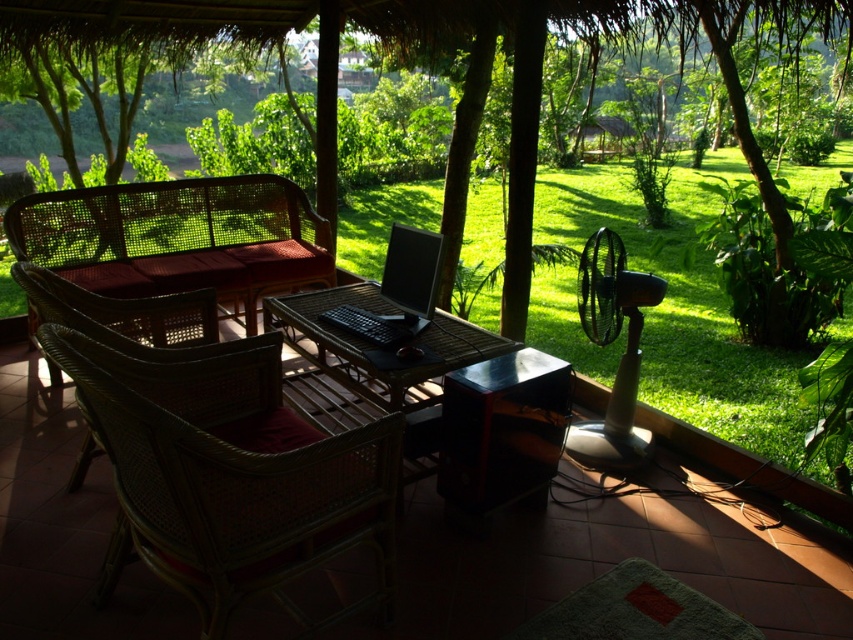
Is point (112, 340) more distant than point (427, 314)?

That is False.

Between woven rattan chair at left and black matte laptop at center, which one is positioned lower?

woven rattan chair at left is below.

Who is more forward, (108,307) or (375,323)?

Point (108,307) is in front.

Where is `woven rattan chair at left`? The image size is (853, 640). woven rattan chair at left is located at coordinates (123, 316).

Between green leafy tree at center and black matte laptop at center, which one has more height?

Standing taller between the two is green leafy tree at center.

Does green leafy tree at center appear under black matte laptop at center?

Incorrect, green leafy tree at center is not positioned below black matte laptop at center.

Between point (155, 24) and point (405, 324), which one is positioned behind?

Point (155, 24)

You are a GUI agent. You are given a task and a screenshot of the screen. Output one action in this format:
    pyautogui.click(x=<x>, y=<y>)
    Task: Click on the green leafy tree at center
    
    Given the screenshot: What is the action you would take?
    pyautogui.click(x=424, y=36)

What do you see at coordinates (424, 36) in the screenshot?
I see `green leafy tree at center` at bounding box center [424, 36].

Is point (531, 90) closer to camera compared to point (90, 458)?

No, it is behind (90, 458).

Based on the photo, who is more forward, (331, 112) or (91, 440)?

Point (91, 440)

The width and height of the screenshot is (853, 640). I want to click on green leafy tree at center, so click(x=424, y=36).